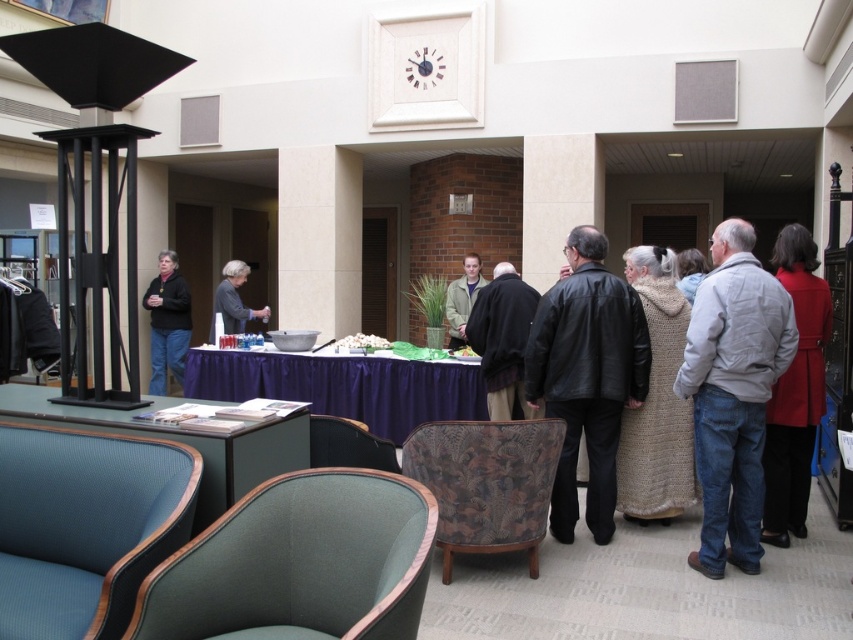
You are standing at point [415,444] and want to walk to the entrance located at point [612,496]. Is the entrance behind you or in front of you?

The entrance at point [612,496] is behind you relative to your current position at point [415,444], so you should turn around to face the entrance.

You are standing in the lobby and need to find the red wool coat at right. According to the spatial description, where exactly is it positioned relative to the other objects in the scene?

The red wool coat at right is located at point (795, 390), which places it near the lower right area of the scene.

You are standing in the lobby and need to locate the black leather jacket at center. According to the coordinates provided, where exactly would you find it?

The black leather jacket at center is located at the coordinates point (585, 376).